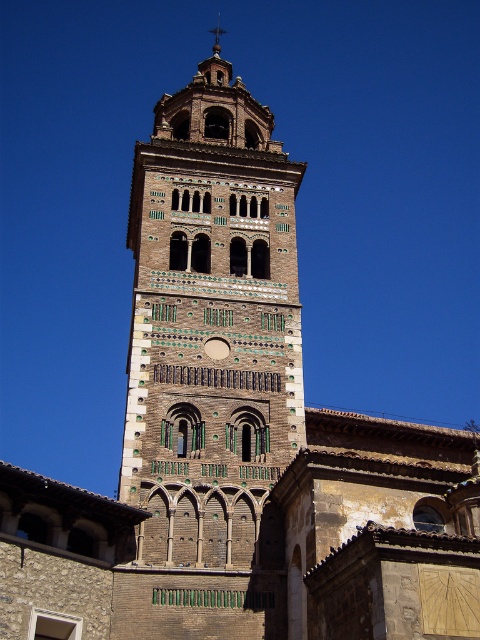
Where is `brown brick tower at center`? This screenshot has width=480, height=640. brown brick tower at center is located at coordinates (211, 324).

Locate an element on the screen. brown brick tower at center is located at coordinates [211, 324].

Image resolution: width=480 pixels, height=640 pixels. I want to click on brown brick tower at center, so click(x=211, y=324).